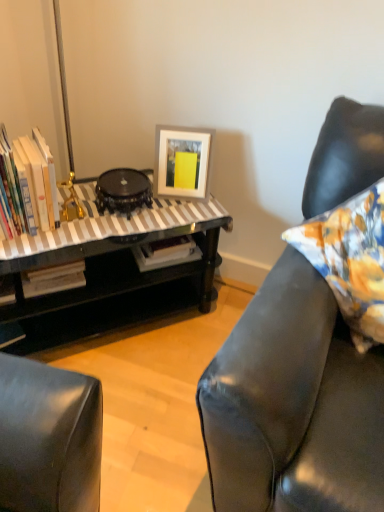
I want to click on black glossy table at left, so click(x=111, y=273).

Describe the element at coordinates (111, 273) in the screenshot. Image resolution: width=384 pixels, height=512 pixels. I see `black glossy table at left` at that location.

In order to click on floral fabric pillow at right in this screenshot , I will do tap(350, 260).

How distant is black glossy round table at center from hardcover books at left?

A distance of 8.95 inches exists between black glossy round table at center and hardcover books at left.

Image resolution: width=384 pixels, height=512 pixels. Find the location of `round table below the hardcover books at left (from a real-world perspective)`. round table below the hardcover books at left (from a real-world perspective) is located at coordinates (123, 191).

Visually, is black glossy round table at center positioned to the left or to the right of hardcover books at left?

In the image, black glossy round table at center appears on the right side of hardcover books at left.

Between black glossy round table at center and hardcover books at left, which one has more height?

With more height is hardcover books at left.

Measure the distance between black glossy round table at center and black glossy table at left.

black glossy round table at center and black glossy table at left are 9.47 inches apart.

Which of these two, black glossy round table at center or black glossy table at left, is wider?

black glossy table at left is wider.

Is black glossy round table at center to the right of black glossy table at left from the viewer's perspective?

Yes.

From the image's perspective, does black glossy round table at center appear higher than black glossy table at left?

Yes, from the image's perspective, black glossy round table at center is on top of black glossy table at left.

Could you tell me if black glossy table at left is turned towards white matte picture frame at upper center?

No, black glossy table at left is not facing towards white matte picture frame at upper center.

How much distance is there between black glossy table at left and white matte picture frame at upper center?

black glossy table at left is 12.25 inches away from white matte picture frame at upper center.

Locate an element on the screen. picture frame on the right of black glossy table at left is located at coordinates (182, 161).

Which object is further away from the camera taking this photo, black glossy table at left or white matte picture frame at upper center?

white matte picture frame at upper center is more distant.

Based on their sizes in the image, would you say hardcover books at left is bigger or smaller than black glossy round table at center?

Considering their sizes, hardcover books at left takes up more space than black glossy round table at center.

Which is more to the right, hardcover books at left or black glossy round table at center?

Positioned to the right is black glossy round table at center.

Is hardcover books at left inside the boundaries of black glossy round table at center, or outside?

hardcover books at left is not inside black glossy round table at center, it's outside.

From a real-world perspective, is hardcover books at left located beneath white matte picture frame at upper center?

No, from a real-world perspective, hardcover books at left is not beneath white matte picture frame at upper center.

Is hardcover books at left facing towards white matte picture frame at upper center?

No.

Identify the location of picture frame above the hardcover books at left (from the image's perspective). Image resolution: width=384 pixels, height=512 pixels. (182, 161).

In the scene shown: From the image's perspective, is hardcover books at left beneath white matte picture frame at upper center?

Yes, from the image's perspective, hardcover books at left is below white matte picture frame at upper center.

Locate an element on the screen. The width and height of the screenshot is (384, 512). book above the white matte picture frame at upper center (from a real-world perspective) is located at coordinates (28, 184).

Choose the correct answer: Is white matte picture frame at upper center inside hardcover books at left or outside it?

white matte picture frame at upper center is spatially situated outside hardcover books at left.

Considering the relative sizes of white matte picture frame at upper center and hardcover books at left in the image provided, is white matte picture frame at upper center smaller than hardcover books at left?

Correct, white matte picture frame at upper center occupies less space than hardcover books at left.

Is white matte picture frame at upper center oriented away from hardcover books at left?

No, white matte picture frame at upper center is not facing away from hardcover books at left.

From the image's perspective, is hardcover books at left beneath black glossy table at left?

No.

Would you say black glossy table at left is part of hardcover books at left's contents?

No.

Is hardcover books at left facing away from black glossy table at left?

Result: No, black glossy table at left is not at the back of hardcover books at left.

This screenshot has width=384, height=512. I want to click on book lying above the black glossy table at left (from the image's perspective), so click(x=28, y=184).

Find the location of `round table located on the right of hardcover books at left`. round table located on the right of hardcover books at left is located at coordinates tap(123, 191).

Where is `round table above the black glossy table at left (from the image's perspective)`? Image resolution: width=384 pixels, height=512 pixels. round table above the black glossy table at left (from the image's perspective) is located at coordinates (123, 191).

Estimate the real-world distances between objects in this image. Which object is closer to black glossy round table at center, white matte picture frame at upper center or hardcover books at left?

Among the two, white matte picture frame at upper center is located nearer to black glossy round table at center.

From the image, which object appears to be nearer to hardcover books at left, white matte picture frame at upper center or black glossy table at left?

black glossy table at left lies closer to hardcover books at left than the other object.

Estimate the real-world distances between objects in this image. Which object is further from floral fabric pillow at right, black glossy table at left or black glossy round table at center?

black glossy round table at center is further to floral fabric pillow at right.

From the picture: Which object lies further to the anchor point floral fabric pillow at right, black glossy table at left or white matte picture frame at upper center?

black glossy table at left is further to floral fabric pillow at right.

Considering their positions, is hardcover books at left positioned further to black glossy round table at center than white matte picture frame at upper center?

The object further to black glossy round table at center is hardcover books at left.

Estimate the real-world distances between objects in this image. Which object is closer to floral fabric pillow at right, white matte picture frame at upper center or hardcover books at left?

white matte picture frame at upper center is closer to floral fabric pillow at right.

Which object lies nearer to the anchor point floral fabric pillow at right, hardcover books at left or black glossy round table at center?

The object closer to floral fabric pillow at right is black glossy round table at center.

Looking at the image, which one is located closer to black glossy round table at center, black glossy table at left or floral fabric pillow at right?

black glossy table at left is closer to black glossy round table at center.

At what (x,y) coordinates should I click in order to perform the action: click on picture frame situated between hardcover books at left and floral fabric pillow at right from left to right. Please return your answer as a coordinate pair (x, y). The width and height of the screenshot is (384, 512). Looking at the image, I should click on (182, 161).

At what (x,y) coordinates should I click in order to perform the action: click on round table located between hardcover books at left and white matte picture frame at upper center in the left-right direction. Please return your answer as a coordinate pair (x, y). The height and width of the screenshot is (512, 384). Looking at the image, I should click on (123, 191).

The width and height of the screenshot is (384, 512). I want to click on round table between floral fabric pillow at right and white matte picture frame at upper center along the z-axis, so click(123, 191).

This screenshot has height=512, width=384. Identify the location of picture frame between black glossy table at left and floral fabric pillow at right in the horizontal direction. (182, 161).